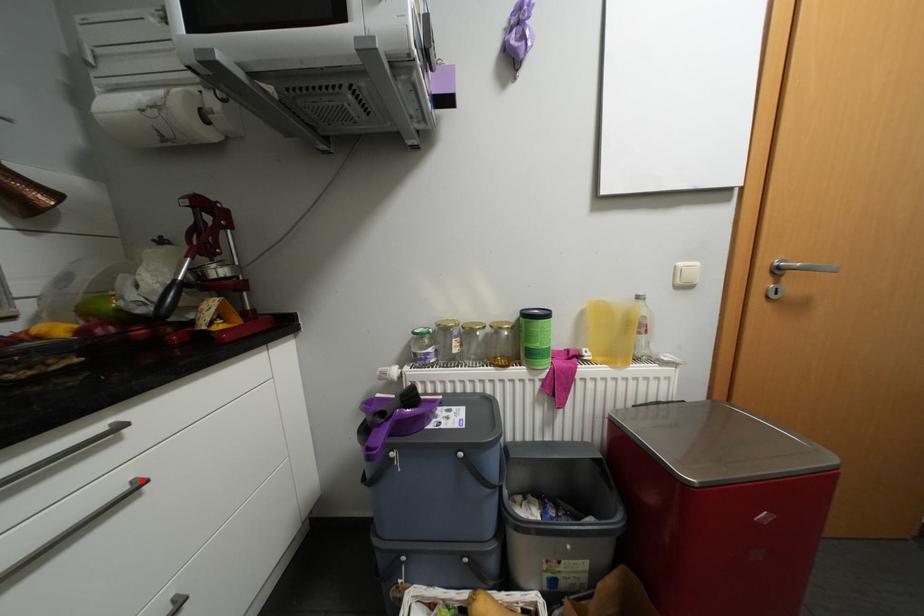
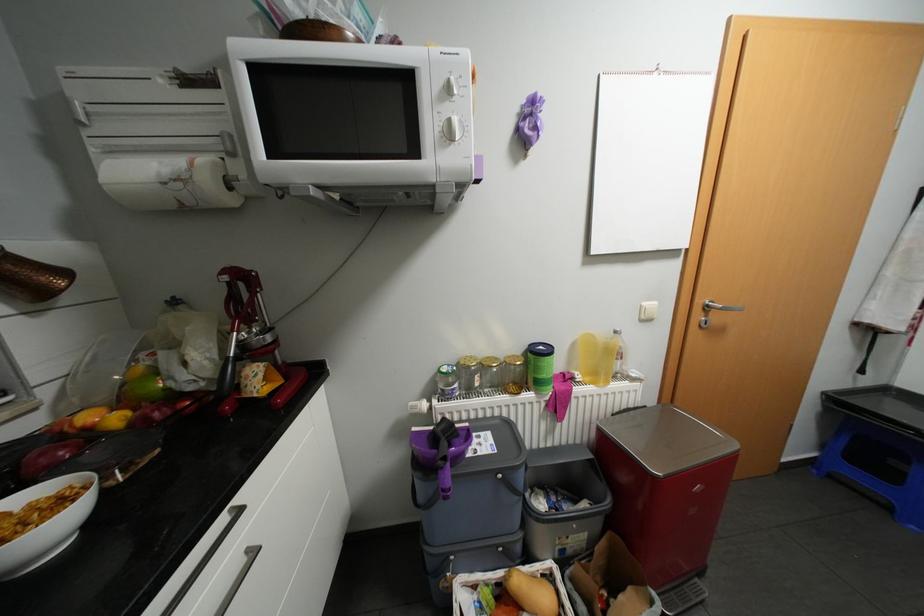
The point at the highlighted location is marked in the first image. Where is the corresponding point in the second image?

(256, 549)